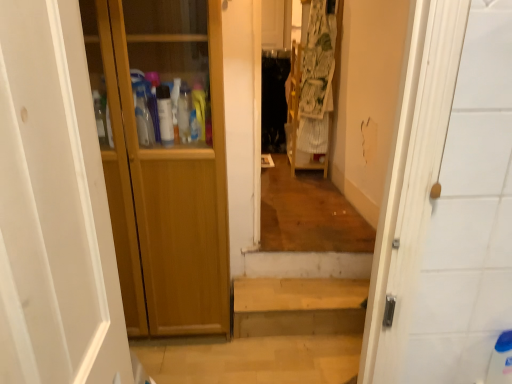
At what (x,y) coordinates should I click in order to perform the action: click on vacant space in between wooden cabinet at left and wooden stairs at center. Please return your answer as a coordinate pair (x, y). Looking at the image, I should click on (272, 337).